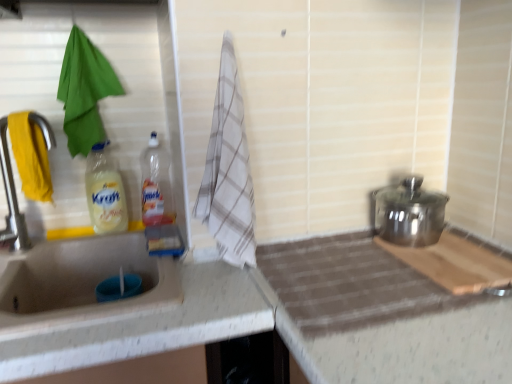
Question: In terms of height, does polished stainless steel pot at right look taller or shorter compared to white checkered towel at center, the 2th beach towel from the back?

Choices:
 (A) short
 (B) tall

Answer: (A)

Question: From the image's perspective, is polished stainless steel pot at right above or below white checkered towel at center, the 1th beach towel in the front-to-back sequence?

Choices:
 (A) below
 (B) above

Answer: (A)

Question: Which object is the closest to the polished stainless steel pot at right?

Choices:
 (A) translucent plastic bottle at center, positioned as the 1th bottle in right-to-left order
 (B) yellow matte bottle at sink left, which is the first bottle in left-to-right order
 (C) matte silver tap at left
 (D) white checkered towel at center, the 1th beach towel in the front-to-back sequence
 (E) green fabric towel at left, which is the second beach towel in right-to-left order

Answer: (D)

Question: Considering the real-world distances, which object is farthest from the green fabric towel at left, positioned as the second beach towel in front-to-back order?

Choices:
 (A) yellow matte bottle at sink left, which is the first bottle in left-to-right order
 (B) white checkered towel at center, the 2th beach towel from the back
 (C) matte silver tap at left
 (D) translucent plastic bottle at center, positioned as the 1th bottle in right-to-left order
 (E) wooden cutting board at right

Answer: (E)